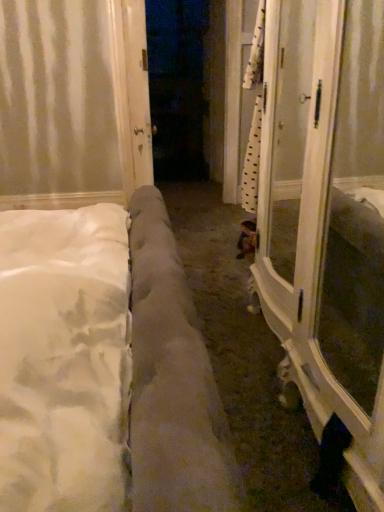
Question: Can you confirm if white glossy door at center is positioned to the right of white glossy screen door at right?

Choices:
 (A) yes
 (B) no

Answer: (B)

Question: Does white glossy door at center have a smaller size compared to white glossy screen door at right?

Choices:
 (A) yes
 (B) no

Answer: (A)

Question: From a real-world perspective, is white glossy door at center located beneath white glossy screen door at right?

Choices:
 (A) yes
 (B) no

Answer: (B)

Question: From the image's perspective, is white glossy door at center located beneath white glossy screen door at right?

Choices:
 (A) yes
 (B) no

Answer: (B)

Question: Is the position of white glossy door at center more distant than that of white glossy screen door at right?

Choices:
 (A) yes
 (B) no

Answer: (A)

Question: Is white glossy door at center located outside white glossy screen door at right?

Choices:
 (A) yes
 (B) no

Answer: (A)

Question: Considering the relative sizes of white glossy screen door at right and white glossy door at center in the image provided, is white glossy screen door at right bigger than white glossy door at center?

Choices:
 (A) no
 (B) yes

Answer: (B)

Question: From a real-world perspective, is white glossy screen door at right physically below white glossy door at center?

Choices:
 (A) yes
 (B) no

Answer: (A)

Question: Is white glossy screen door at right to the right of white glossy door at center from the viewer's perspective?

Choices:
 (A) yes
 (B) no

Answer: (A)

Question: Can you confirm if white glossy screen door at right is smaller than white glossy door at center?

Choices:
 (A) yes
 (B) no

Answer: (B)

Question: Can we say white glossy screen door at right lies outside white glossy door at center?

Choices:
 (A) no
 (B) yes

Answer: (B)

Question: From the image's perspective, is white glossy screen door at right on top of white glossy door at center?

Choices:
 (A) yes
 (B) no

Answer: (B)

Question: From their relative heights in the image, would you say white glossy door at center is taller or shorter than white glossy screen door at right?

Choices:
 (A) short
 (B) tall

Answer: (B)